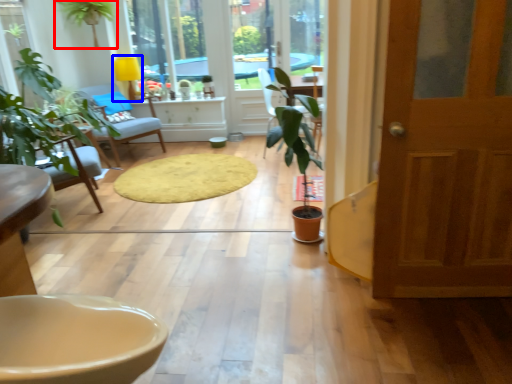
Question: Which of the following is the farthest to the observer, houseplant (highlighted by a red box) or lamp (highlighted by a blue box)?

Choices:
 (A) houseplant
 (B) lamp

Answer: (B)